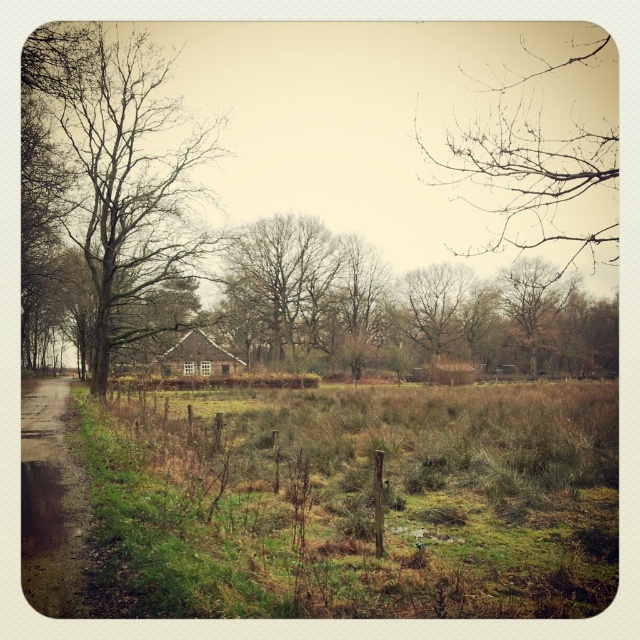
Question: Where is green leafy tree at center located in relation to brown textured tree at upper center in the image?

Choices:
 (A) right
 (B) left

Answer: (B)

Question: Which object is closer to the camera taking this photo?

Choices:
 (A) bare branches at upper center
 (B) green grassy field at center
 (C) brown wooden hut at center
 (D) brown textured tree at upper center

Answer: (B)

Question: Is brown leafless tree at center positioned at the back of damp dirt path at left?

Choices:
 (A) yes
 (B) no

Answer: (A)

Question: Among these points, which one is farthest from the camera?

Choices:
 (A) 529,346
 (B) 177,172

Answer: (A)

Question: Considering the relative positions of bare branches at upper center and bare branches at center in the image provided, where is bare branches at upper center located with respect to bare branches at center?

Choices:
 (A) below
 (B) above

Answer: (B)

Question: Which point is closer to the camera taking this photo?

Choices:
 (A) (419, 296)
 (B) (525, 332)
 (C) (77, 588)
 (D) (252, 236)

Answer: (C)